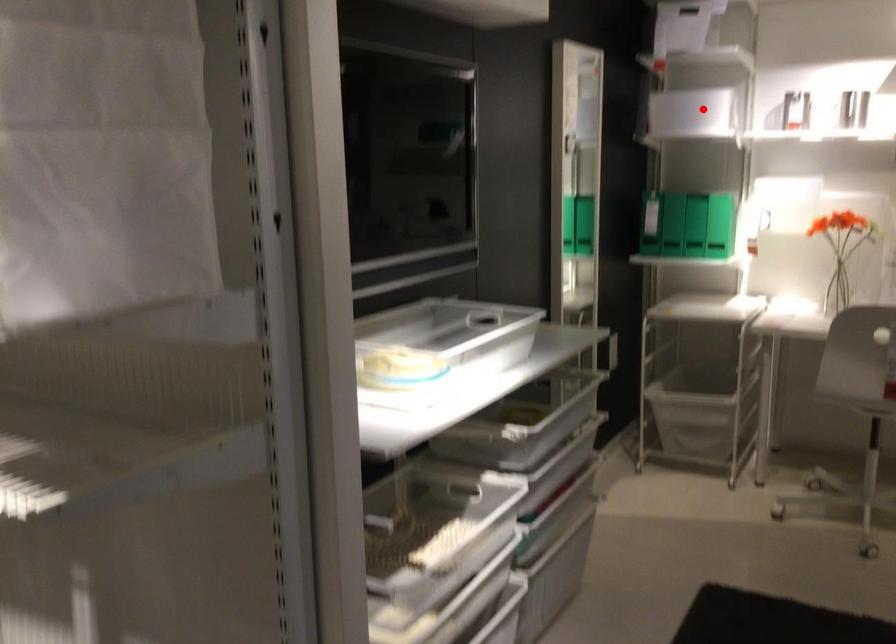
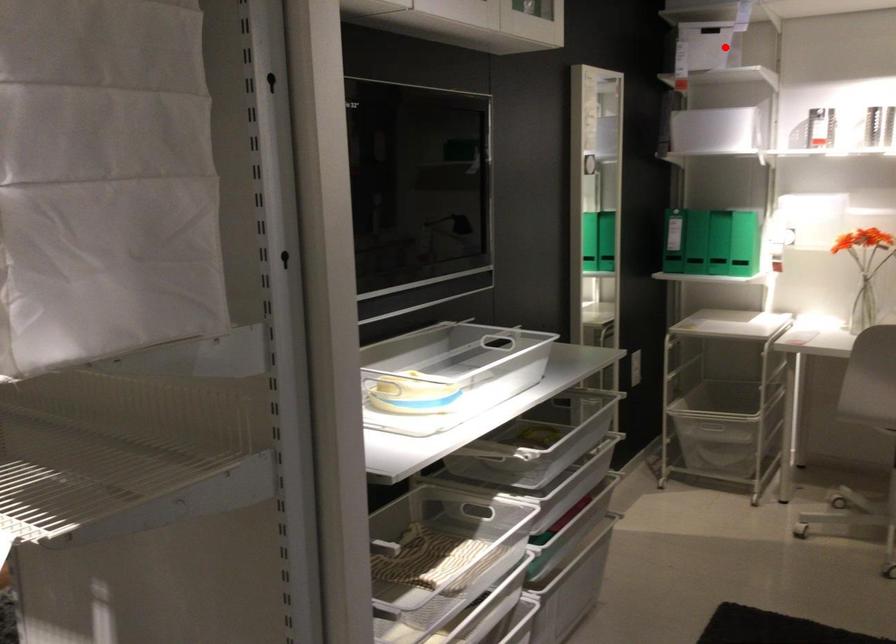
I am providing you with two images of the same scene from different viewpoints. A red point is marked on the first image and another point is marked on the second image. Are the points marked in image1 and image2 representing the same 3D position?

No